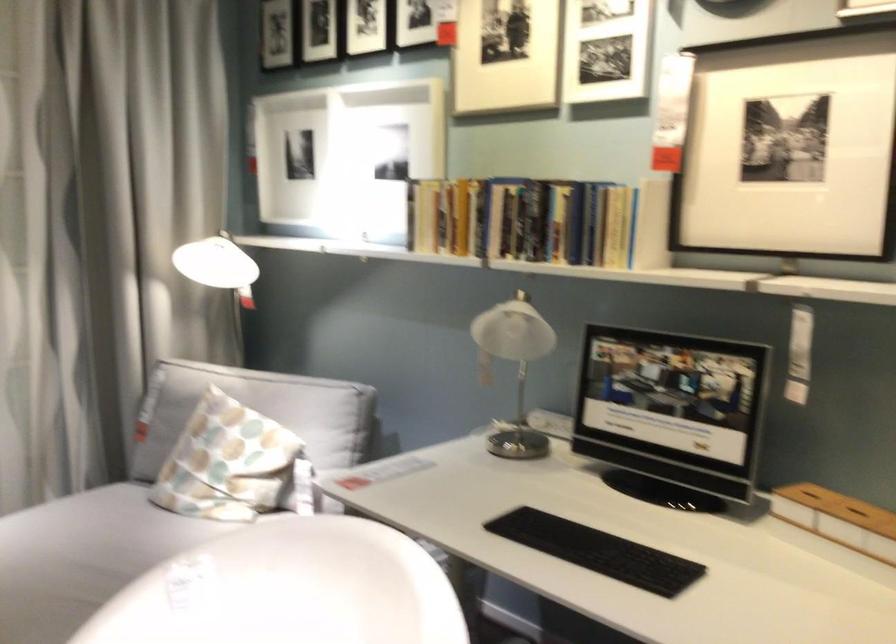
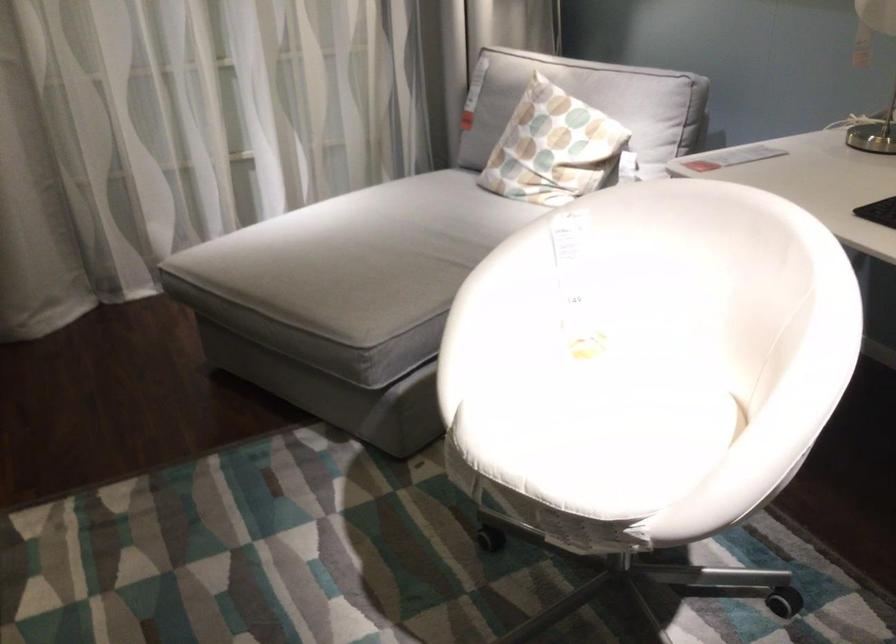
In the second image, find the point that corresponds to point 238,459 in the first image.

(553, 147)